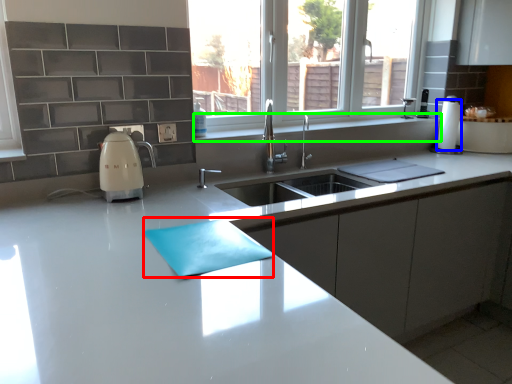
Question: Which is nearer to the place mat (highlighted by a red box)? paper towel (highlighted by a blue box) or window sill (highlighted by a green box).

Choices:
 (A) paper towel
 (B) window sill

Answer: (B)